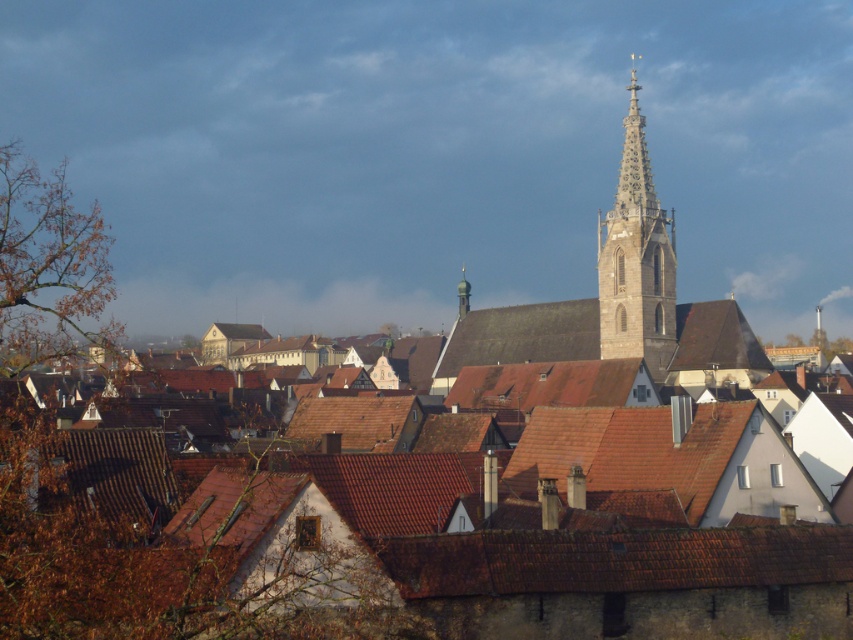
Locate an element on the screen. Image resolution: width=853 pixels, height=640 pixels. brown tile roof at lower center is located at coordinates (614, 560).

Can you confirm if brown tile roof at lower center is shorter than stone steeple at center?

Yes, brown tile roof at lower center is shorter than stone steeple at center.

Is point (589, 561) behind point (608, 305)?

No, it is in front of (608, 305).

At what (x,y) coordinates should I click in order to perform the action: click on brown tile roof at lower center. Please return your answer as a coordinate pair (x, y). Looking at the image, I should click on (614, 560).

Is brown tile roof at lower center positioned at the back of green metallic spire at upper center?

No, brown tile roof at lower center is in front of green metallic spire at upper center.

Is point (665, 588) more distant than point (459, 291)?

No, (665, 588) is closer to viewer.

You are a GUI agent. You are given a task and a screenshot of the screen. Output one action in this format:
    pyautogui.click(x=<x>, y=<y>)
    Task: Click on the brown tile roof at lower center
    
    Given the screenshot: What is the action you would take?
    pyautogui.click(x=614, y=560)

Which of these two, stone steeple at center or green metallic spire at upper center, stands taller?

Standing taller between the two is stone steeple at center.

Does stone steeple at center come behind green metallic spire at upper center?

No, stone steeple at center is closer to the viewer.

Measure the distance between point (637, 141) and camera.

Point (637, 141) is 169.55 meters away from camera.

Where is `stone steeple at center`? The width and height of the screenshot is (853, 640). stone steeple at center is located at coordinates (636, 259).